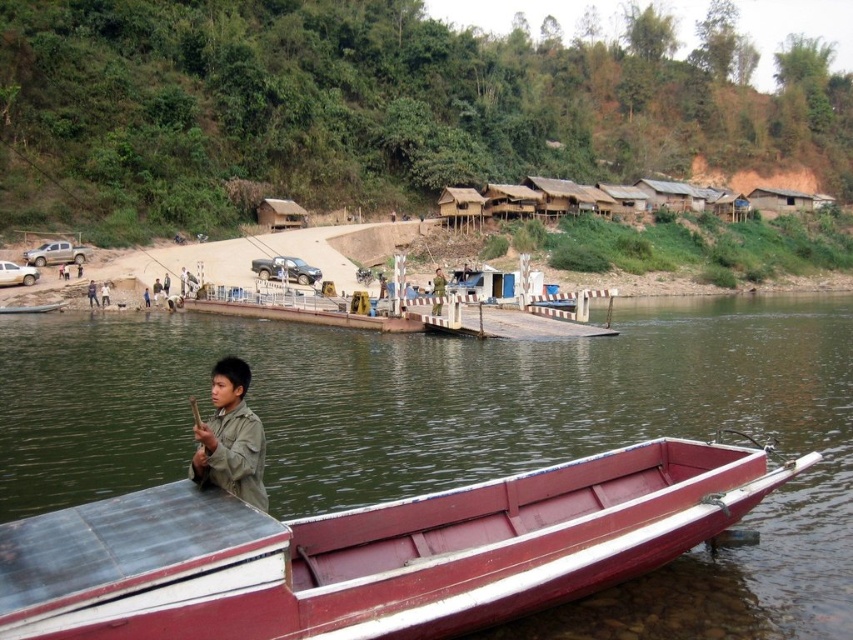
You are planning to place a new bench in the riverside scene. The bench requires a space larger than the smooth red wood boat at lower center. Can the green matte shirt at lower left accommodate the bench?

The smooth red wood boat at lower center occupies less space than green matte shirt at lower left, so the bench can be placed at the location of the green matte shirt at lower left since it has enough space.

You are standing at the riverside and want to reach the two points marked in the image. Which point, point (265, 589) or point (213, 429), is closer to you?

Point (265, 589) is closer to the viewer than point (213, 429).

You are a photographer trying to capture a wide shot of the smooth red wood boat at lower center and the green matte shirt at lower left. Given that your camera can only focus on objects within a 2m width, will both objects fit in the frame?

The smooth red wood boat at lower center is wider than the green matte shirt at lower left. Since the camera can focus on objects within a 2m width, but the boat is wider than the shirt, it depends on the boat and shirt combined width. However, the description only states the boat is larger in width than the shirt, not their exact measurements. Without specific dimensions, it is impossible to determine if both will fit within the 2m width constraint.